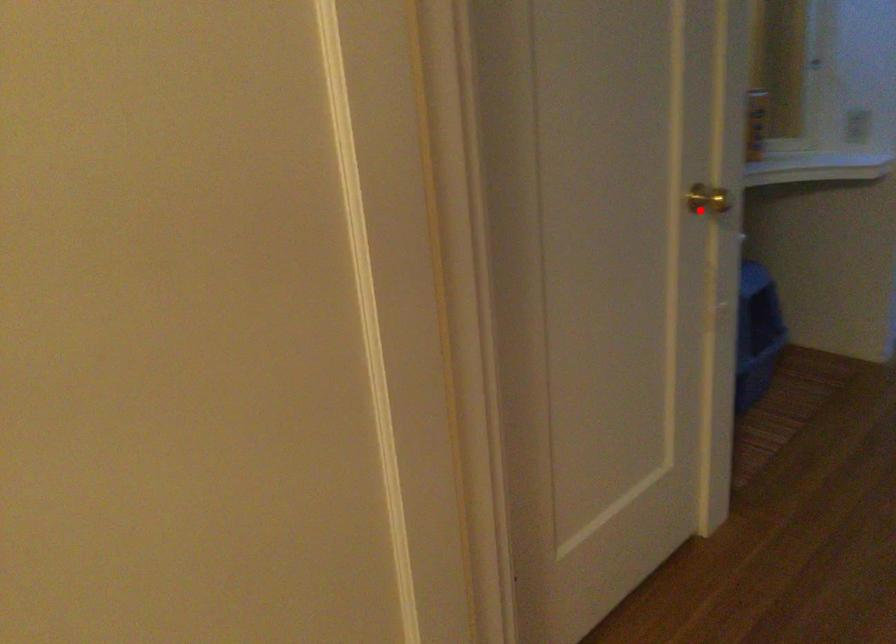
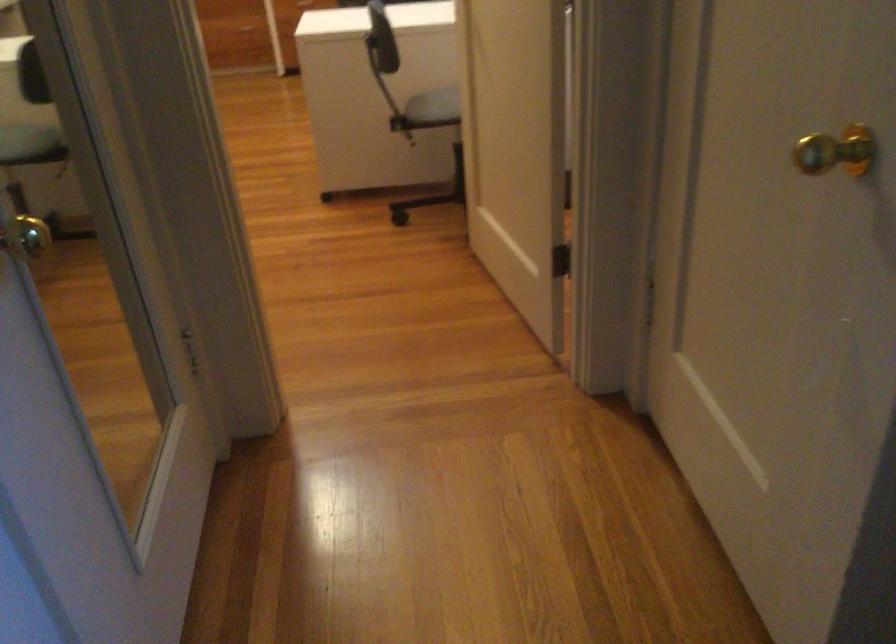
Question: I am providing you with two images of the same scene from different viewpoints. A red point is shown in image1. For the corresponding object point in image2, is it positioned nearer or farther from the camera?

Choices:
 (A) Nearer
 (B) Farther

Answer: (A)